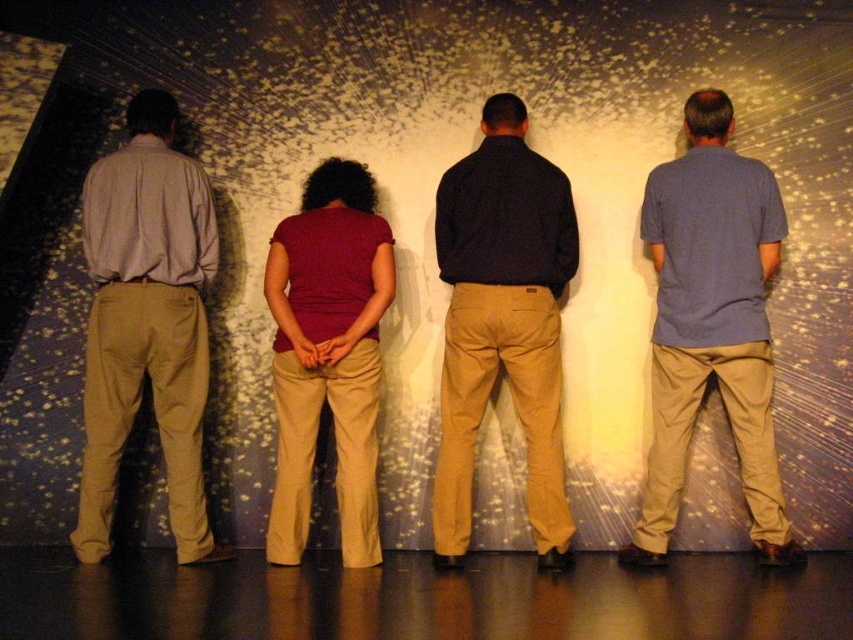
Question: Based on their relative distances, which object is nearer to the dark blue shirt at center?

Choices:
 (A) matte red blouse at center
 (B) matte khaki pants at left
 (C) matte blue shirt at right

Answer: (A)

Question: Does matte khaki pants at left appear on the right side of matte red blouse at center?

Choices:
 (A) no
 (B) yes

Answer: (A)

Question: Does matte khaki pants at left have a lesser width compared to matte red blouse at center?

Choices:
 (A) no
 (B) yes

Answer: (A)

Question: Among these points, which one is nearest to the camera?

Choices:
 (A) (289, 404)
 (B) (570, 528)
 (C) (132, 282)
 (D) (717, 141)

Answer: (C)

Question: Which of the following is the farthest from the observer?

Choices:
 (A) (538, 481)
 (B) (280, 554)
 (C) (721, 93)

Answer: (C)

Question: Is matte blue shirt at right below matte red blouse at center?

Choices:
 (A) no
 (B) yes

Answer: (A)